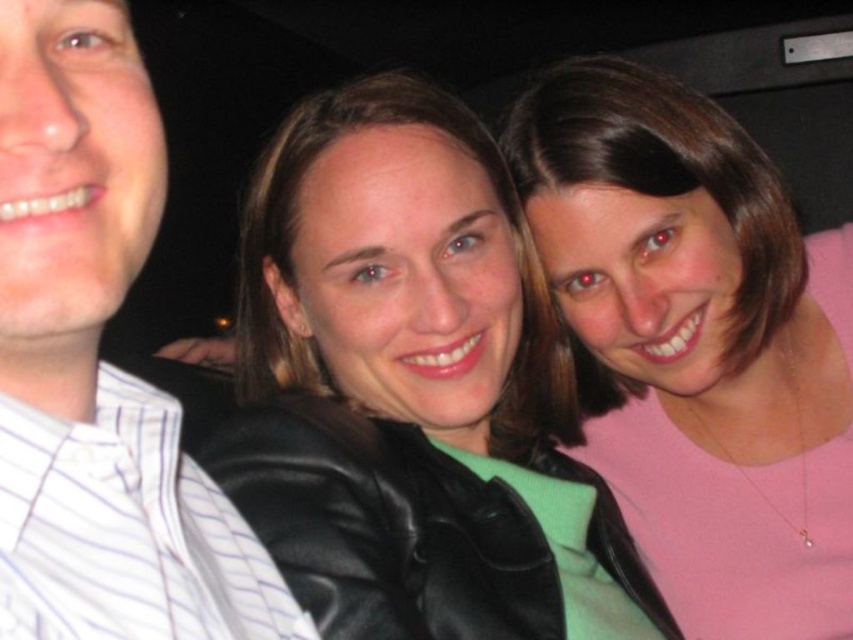
Question: Which of the following is the farthest from the observer?

Choices:
 (A) (758, 452)
 (B) (355, 301)
 (C) (90, 538)

Answer: (A)

Question: Considering the real-world distances, which object is closest to the black leather jacket at center?

Choices:
 (A) white striped shirt at left
 (B) pink matte shirt at center

Answer: (B)

Question: Is black leather jacket at center below pink matte shirt at center?

Choices:
 (A) yes
 (B) no

Answer: (A)

Question: Can you confirm if black leather jacket at center is bigger than pink matte shirt at center?

Choices:
 (A) no
 (B) yes

Answer: (B)

Question: Among these points, which one is nearest to the camera?

Choices:
 (A) (524, 122)
 (B) (26, 326)
 (C) (468, 612)

Answer: (B)

Question: Does black leather jacket at center have a smaller size compared to white striped shirt at left?

Choices:
 (A) yes
 (B) no

Answer: (B)